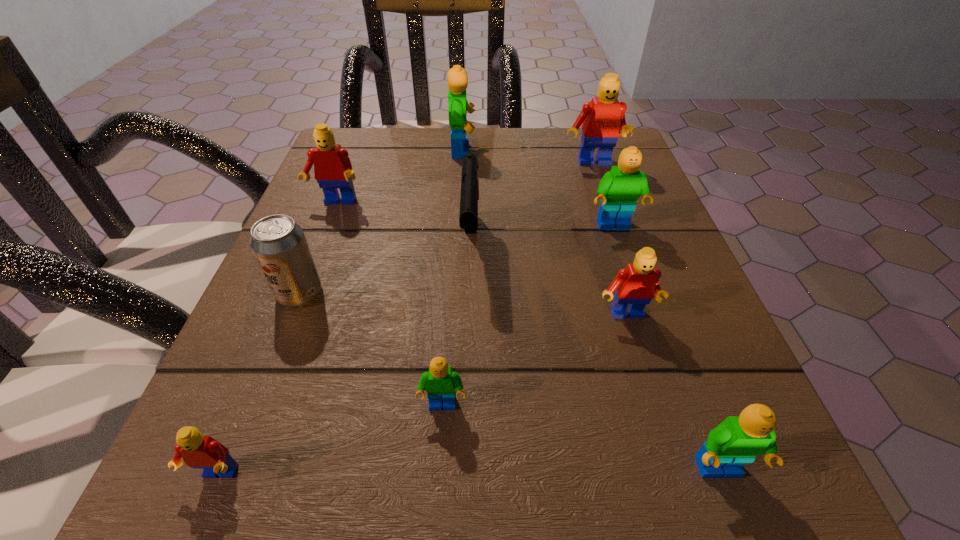
Locate an element on the screen. vacant space in between the black pistol and the beer can is located at coordinates (385, 269).

Locate an element on the screen. free spot between the second nearest green Lego and the farthest green Lego is located at coordinates (453, 279).

Where is `the sixth closest object to the beer can`? the sixth closest object to the beer can is located at coordinates (636, 285).

I want to click on object that stands as the eighth closest to the beer can, so click(x=737, y=440).

Identify the location of the fourth closest Lego to the pistol. The width and height of the screenshot is (960, 540). (619, 189).

You are a GUI agent. You are given a task and a screenshot of the screen. Output one action in this format:
    pyautogui.click(x=<x>, y=<y>)
    Task: Click on the Lego object that ranks as the fifth closest to the nearest green Lego
    The image size is (960, 540).
    Given the screenshot: What is the action you would take?
    pyautogui.click(x=601, y=119)

Identify which green Lego is the fourth closest to the nearest red Lego. Please provide its 2D coordinates. Your answer should be formatted as a tuple, i.e. [(x, y)], where the tuple contains the x and y coordinates of a point satisfying the conditions above.

[(458, 106)]

Locate an element on the screen. green Lego that is the third closest to the third farthest object is located at coordinates (619, 189).

Locate which red Lego is the closest to the black pistol. Please provide its 2D coordinates. Your answer should be formatted as a tuple, i.e. [(x, y)], where the tuple contains the x and y coordinates of a point satisfying the conditions above.

[(636, 285)]

Where is `the closest red Lego to the second farthest green Lego`? This screenshot has width=960, height=540. the closest red Lego to the second farthest green Lego is located at coordinates (601, 119).